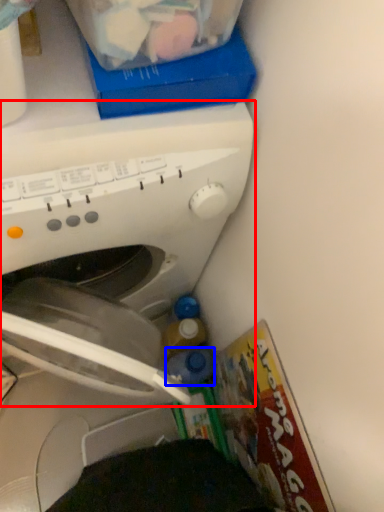
Question: Which object is further to the camera taking this photo, washing machine (highlighted by a red box) or bottle (highlighted by a blue box)?

Choices:
 (A) washing machine
 (B) bottle

Answer: (B)